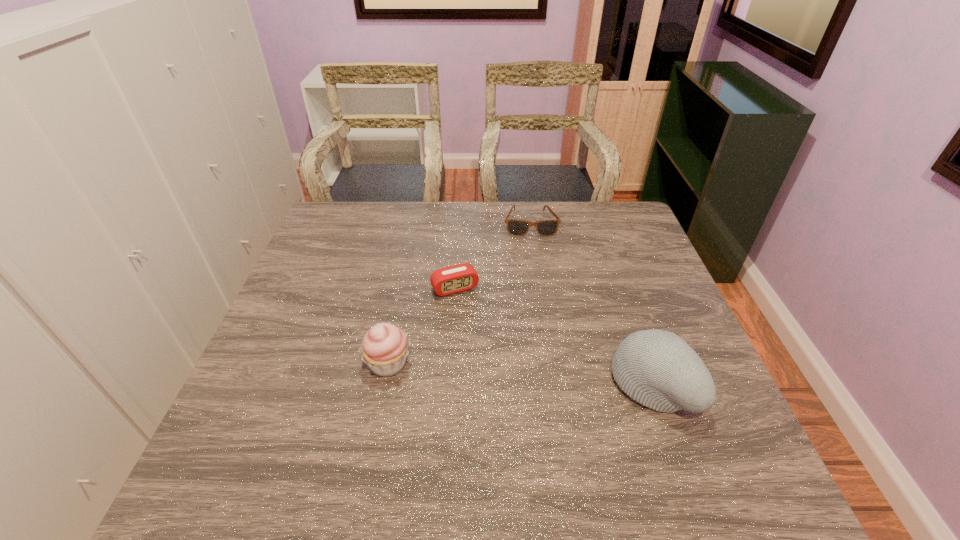
The image size is (960, 540). Find the location of `free spot located 0.210m on the frames of the third object from left to right`. free spot located 0.210m on the frames of the third object from left to right is located at coordinates (538, 280).

Where is `vacant position located 0.300m on the front-facing side of the alarm clock`? vacant position located 0.300m on the front-facing side of the alarm clock is located at coordinates (507, 385).

Where is `vacant space located on the front-facing side of the alarm clock`? The height and width of the screenshot is (540, 960). vacant space located on the front-facing side of the alarm clock is located at coordinates (518, 407).

Locate an element on the screen. This screenshot has width=960, height=540. vacant space located on the front-facing side of the alarm clock is located at coordinates (491, 352).

The height and width of the screenshot is (540, 960). Identify the location of object at the far edge. (515, 227).

Find the location of `object located in the near edge section of the desktop`. object located in the near edge section of the desktop is located at coordinates (658, 369).

Identify the location of object that is at the right edge. Image resolution: width=960 pixels, height=540 pixels. (658, 369).

I want to click on object situated at the near right corner, so click(x=658, y=369).

The image size is (960, 540). Find the location of `free space at the far edge of the desktop`. free space at the far edge of the desktop is located at coordinates (441, 218).

The image size is (960, 540). In the image, there is a desktop. Find the location of `free space at the near edge`. free space at the near edge is located at coordinates (463, 408).